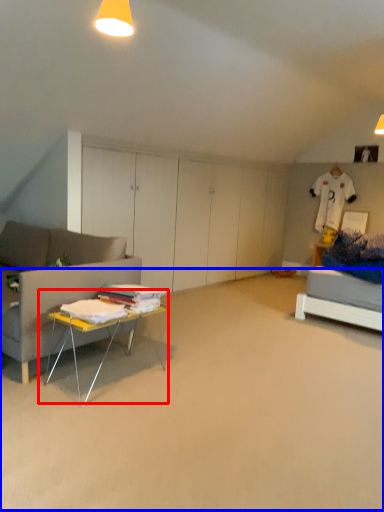
Question: Which point is closer to the camera, table (highlighted by a red box) or plain (highlighted by a blue box)?

Choices:
 (A) table
 (B) plain

Answer: (B)